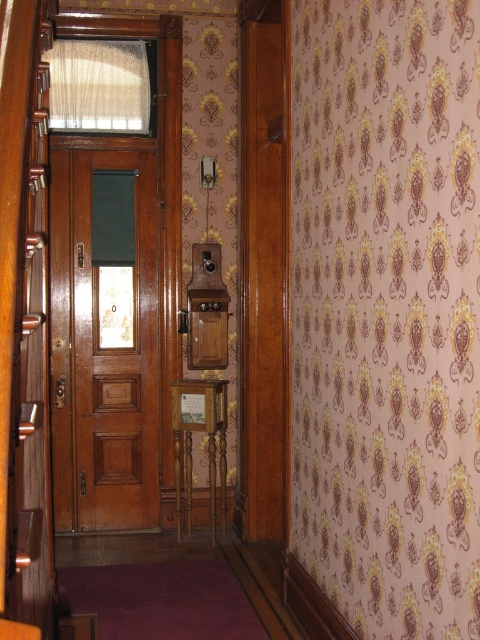
You are standing in the hallway and want to exit through the door. Which object is closer to the exit, the wooden door at center or the silky beige curtain at upper center?

The wooden door at center is closer to the exit than the silky beige curtain at upper center because it is positioned to the right of the curtain, which is located further away from the exit.